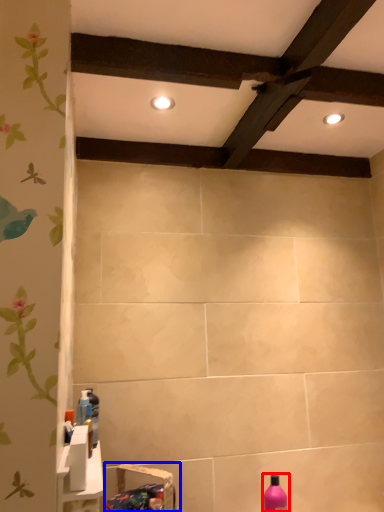
Question: Among these objects, which one is farthest to the camera, bottle (highlighted by a red box) or sink (highlighted by a blue box)?

Choices:
 (A) bottle
 (B) sink

Answer: (A)